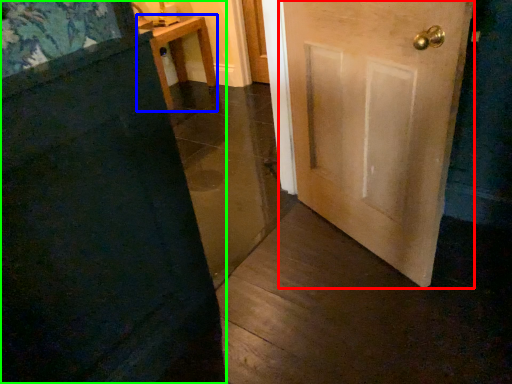
Question: Which object is the farthest from door (highlighted by a red box)? Choose among these: furniture (highlighted by a blue box) or door (highlighted by a green box).

Choices:
 (A) furniture
 (B) door

Answer: (A)